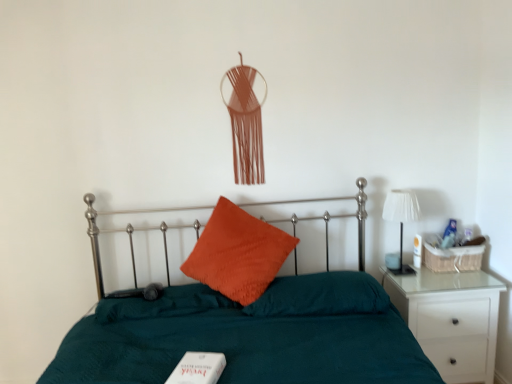
The height and width of the screenshot is (384, 512). Find the location of `white matte book at lower center`. white matte book at lower center is located at coordinates (198, 368).

The image size is (512, 384). What do you see at coordinates (198, 368) in the screenshot? I see `white matte book at lower center` at bounding box center [198, 368].

This screenshot has height=384, width=512. Describe the element at coordinates (238, 253) in the screenshot. I see `orange cotton pillow at center, the 2th pillow viewed from the right` at that location.

Describe the element at coordinates (451, 319) in the screenshot. I see `white glossy nightstand at right` at that location.

What do you see at coordinates (401, 219) in the screenshot?
I see `white fabric lampshade at right` at bounding box center [401, 219].

This screenshot has height=384, width=512. What are the coordinates of `white matte book at lower center` in the screenshot? It's located at 198,368.

Is teal fabric bed at center positioned far away from white matte book at lower center?

No, teal fabric bed at center is not far away from white matte book at lower center.

From a real-world perspective, who is located lower, teal fabric bed at center or white matte book at lower center?

teal fabric bed at center.

Who is shorter, teal fabric bed at center or white matte book at lower center?

white matte book at lower center.

Can you tell me how much teal fabric bed at center and white matte book at lower center differ in facing direction?

16.1 degrees separate the facing orientations of teal fabric bed at center and white matte book at lower center.

In the scene shown: Considering the positions of objects orange velvet pillow at center, which is the first pillow from right to left, and white matte book at lower center in the image provided, who is more to the right, orange velvet pillow at center, which is the first pillow from right to left, or white matte book at lower center?

orange velvet pillow at center, which is the first pillow from right to left, is more to the right.

From a real-world perspective, is orange velvet pillow at center, which is the first pillow from right to left, physically above white matte book at lower center?

Correct, in the physical world, orange velvet pillow at center, which is the first pillow from right to left, is higher than white matte book at lower center.

Considering their positions, is orange velvet pillow at center, which is the first pillow from right to left, located in front of or behind white matte book at lower center?

Visually, orange velvet pillow at center, which is the first pillow from right to left, is located behind white matte book at lower center.

Is point (348, 295) positioned behind point (198, 361)?

Yes.

Is white fabric lampshade at right not inside white glossy nightstand at right?

Absolutely, white fabric lampshade at right is external to white glossy nightstand at right.

Which is behind, white fabric lampshade at right or white glossy nightstand at right?

white fabric lampshade at right is more distant.

Is white fabric lampshade at right turned away from white glossy nightstand at right?

No, white fabric lampshade at right is not facing the opposite direction of white glossy nightstand at right.

Does white fabric lampshade at right have a lesser width compared to white glossy nightstand at right?

Correct, the width of white fabric lampshade at right is less than that of white glossy nightstand at right.

The image size is (512, 384). Find the location of `nightstand below the white matte book at lower center (from a real-world perspective)`. nightstand below the white matte book at lower center (from a real-world perspective) is located at coordinates (451, 319).

How much distance is there between white matte book at lower center and white glossy nightstand at right?

The distance of white matte book at lower center from white glossy nightstand at right is 1.24 meters.

From the image's perspective, is white matte book at lower center above or below white glossy nightstand at right?

Clearly, from the image's perspective, white matte book at lower center is above white glossy nightstand at right.

Does white matte book at lower center lie behind orange velvet pillow at center, which is the first pillow from right to left?

No, the depth of white matte book at lower center is less than that of orange velvet pillow at center, which is the first pillow from right to left.

Looking at this image, are white matte book at lower center and orange velvet pillow at center, which is the first pillow from right to left, located far from each other?

No, white matte book at lower center is not far away from orange velvet pillow at center, which is the first pillow from right to left.

Can you confirm if white matte book at lower center is bigger than orange velvet pillow at center, which is the first pillow from right to left?

Incorrect, white matte book at lower center is not larger than orange velvet pillow at center, which is the first pillow from right to left.

Is white matte book at lower center facing away from orange velvet pillow at center, which is the first pillow from right to left?

Absolutely, white matte book at lower center is directed away from orange velvet pillow at center, which is the first pillow from right to left.

Could you tell me if orange velvet pillow at center, the 2th pillow from the left, is turned towards orange cotton pillow at center, the 2th pillow viewed from the right?

No, orange velvet pillow at center, the 2th pillow from the left, is not aimed at orange cotton pillow at center, the 2th pillow viewed from the right.

Is orange velvet pillow at center, the 2th pillow from the left, taller or shorter than orange cotton pillow at center, the 2th pillow viewed from the right?

Clearly, orange velvet pillow at center, the 2th pillow from the left, is shorter compared to orange cotton pillow at center, the 2th pillow viewed from the right.

Is orange velvet pillow at center, the 2th pillow from the left, surrounding orange cotton pillow at center, the 2th pillow viewed from the right?

Actually, orange cotton pillow at center, the 2th pillow viewed from the right, is outside orange velvet pillow at center, the 2th pillow from the left.

How much distance is there between white matte book at lower center and teal fabric bed at center?

white matte book at lower center and teal fabric bed at center are 13.71 inches apart.

From a real-world perspective, is white matte book at lower center on top of teal fabric bed at center?

Correct, in the physical world, white matte book at lower center is higher than teal fabric bed at center.

From the image's perspective, between white matte book at lower center and teal fabric bed at center, who is located below?

teal fabric bed at center appears lower in the image.

Based on the photo, which object is closer to the camera, white matte book at lower center or teal fabric bed at center?

teal fabric bed at center is in front.

The height and width of the screenshot is (384, 512). Identify the location of bed that appears below the white matte book at lower center (from a real-world perspective). (249, 336).

Locate an element on the screen. Image resolution: width=512 pixels, height=384 pixels. book below the orange velvet pillow at center, the 2th pillow from the left (from the image's perspective) is located at coordinates (198, 368).

Estimate the real-world distances between objects in this image. Which object is further from white fabric lampshade at right, orange velvet pillow at center, the 2th pillow from the left, or teal fabric bed at center?

teal fabric bed at center.

Which object lies further to the anchor point orange cotton pillow at center, placed as the first pillow when sorted from left to right, orange velvet pillow at center, the 2th pillow from the left, or white glossy nightstand at right?

The object further to orange cotton pillow at center, placed as the first pillow when sorted from left to right, is white glossy nightstand at right.

When comparing their distances from teal fabric bed at center, does white fabric lampshade at right or white glossy nightstand at right seem closer?

white glossy nightstand at right lies closer to teal fabric bed at center than the other object.

Based on their spatial positions, is white matte book at lower center or orange velvet pillow at center, the 2th pillow from the left, further from white fabric lampshade at right?

The object further to white fabric lampshade at right is white matte book at lower center.

From the image, which object appears to be farther from teal fabric bed at center, orange cotton pillow at center, the 2th pillow viewed from the right, or white fabric lampshade at right?

The object further to teal fabric bed at center is white fabric lampshade at right.

Based on the photo, considering their positions, is orange velvet pillow at center, the 2th pillow from the left, positioned further to teal fabric bed at center than white matte book at lower center?

white matte book at lower center lies further to teal fabric bed at center than the other object.

From the image, which object appears to be farther from orange cotton pillow at center, the 2th pillow viewed from the right, white fabric lampshade at right or teal fabric bed at center?

white fabric lampshade at right is further to orange cotton pillow at center, the 2th pillow viewed from the right.

From the image, which object appears to be farther from orange cotton pillow at center, the 2th pillow viewed from the right, teal fabric bed at center or white glossy nightstand at right?

white glossy nightstand at right.

The width and height of the screenshot is (512, 384). In order to click on nightstand positioned between teal fabric bed at center and white fabric lampshade at right from near to far in this screenshot , I will do `click(451, 319)`.

Identify the location of book between teal fabric bed at center and white fabric lampshade at right along the z-axis. This screenshot has height=384, width=512. (198, 368).

You are a GUI agent. You are given a task and a screenshot of the screen. Output one action in this format:
    pyautogui.click(x=<x>, y=<y>)
    Task: Click on the pillow positioned between teal fabric bed at center and orange velvet pillow at center, which is the first pillow from right to left, from near to far
    
    Given the screenshot: What is the action you would take?
    pyautogui.click(x=238, y=253)

The height and width of the screenshot is (384, 512). In order to click on table lamp located between white matte book at lower center and white glossy nightstand at right in the left-right direction in this screenshot , I will do `click(401, 219)`.